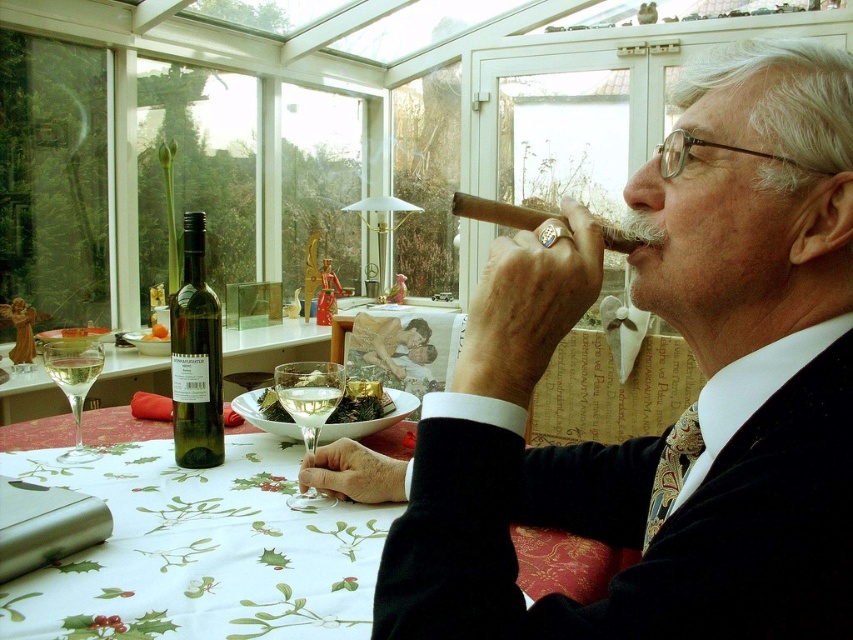
You are a guest at this holiday gathering and want to grab the clear glass wine at table center. However, there is a smooth brown cigar at upper right in the way. Can you reach the wine without moving the cigar?

The smooth brown cigar at upper right is closer to the viewer than the clear glass wine at table center, so you would have to move the cigar to reach the wine.

You are a guest at a holiday party and want to pour yourself a glass of wine from the green glass bottle at left into the clear glass wine glass at center. Can you reach the bottle without moving the glass?

The green glass bottle at left is further to the viewer than the clear glass wine glass at center, so yes, you can reach the bottle without moving the glass because it is closer to you.